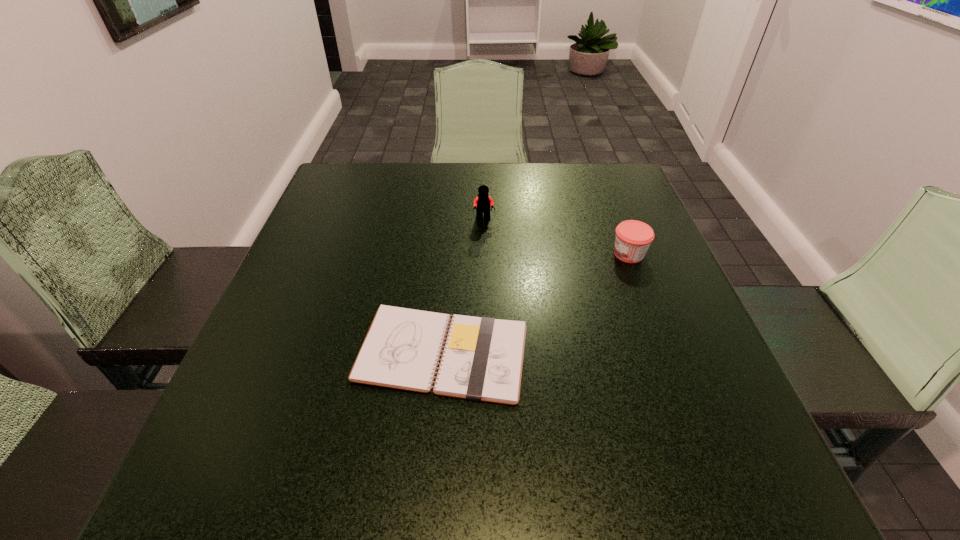
The height and width of the screenshot is (540, 960). Identify the location of Lego. (483, 202).

Where is `the tallest object`? The width and height of the screenshot is (960, 540). the tallest object is located at coordinates (483, 202).

This screenshot has width=960, height=540. Identify the location of the second nearest object. (633, 238).

Locate an element on the screen. Image resolution: width=960 pixels, height=540 pixels. the second tallest object is located at coordinates (633, 238).

You are a GUI agent. You are given a task and a screenshot of the screen. Output one action in this format:
    pyautogui.click(x=<x>, y=<y>)
    Task: Click on the notepad
    This screenshot has width=960, height=540.
    Given the screenshot: What is the action you would take?
    pyautogui.click(x=482, y=360)

This screenshot has height=540, width=960. In order to click on the nearest object in this screenshot , I will do `click(482, 360)`.

Locate an element on the screen. vacant space located 0.090m on the front-facing side of the Lego is located at coordinates (484, 246).

The height and width of the screenshot is (540, 960). I want to click on vacant space located on the front label of the second shortest object, so click(496, 254).

Locate an element on the screen. vacant space situated on the front label of the second shortest object is located at coordinates (475, 254).

This screenshot has height=540, width=960. I want to click on blank space located on the front label of the second shortest object, so click(x=563, y=254).